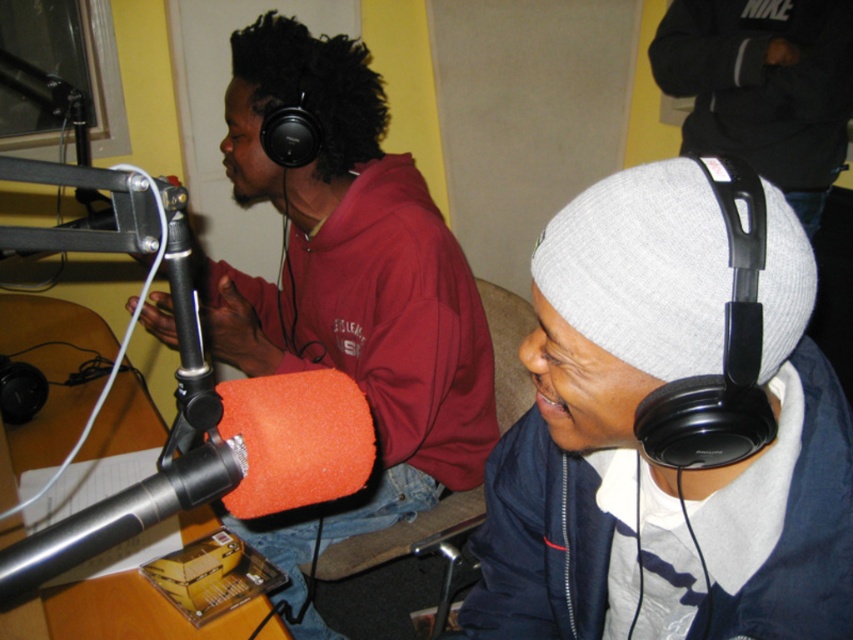
You are an audio engineer setting up for a session. You need to place both the gray knit beanie at upper right and the matte black headphones at left on the desk. The desk has limited vertical space. Which object should you place first to ensure both fit vertically?

The gray knit beanie at upper right is shorter than the matte black headphones at left. Place the shorter beanie first, then the taller headphones to utilize vertical space efficiently.

You are a sound engineer who needs to adjust the settings on your camera while monitoring audio through the matte black headphones at left. Can you reach the camera from your current position without moving your head?

The matte black headphones at left and camera are 3.75 feet apart. Since the average human arm reaches about 2.5 feet, you would need to move your head or adjust your position to reach the camera.